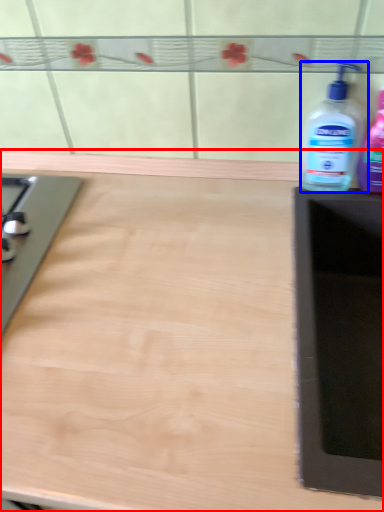
Question: Among these objects, which one is nearest to the camera, countertop (highlighted by a red box) or bottle (highlighted by a blue box)?

Choices:
 (A) countertop
 (B) bottle

Answer: (A)